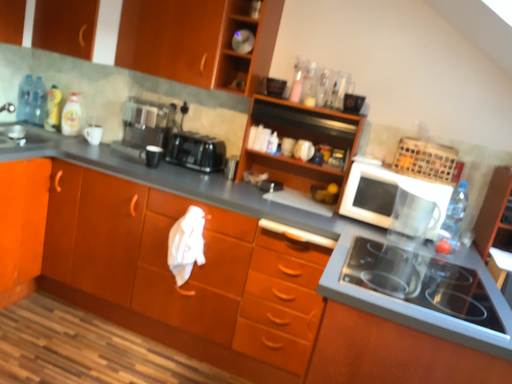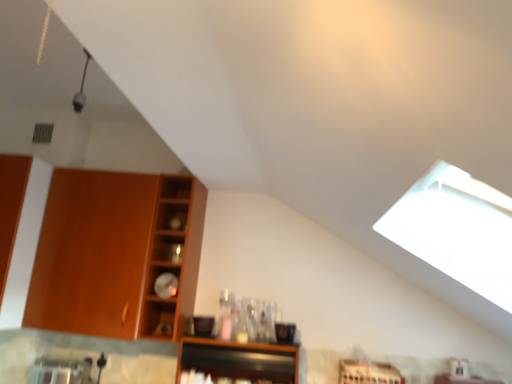
Question: Which way did the camera rotate in the video?

Choices:
 (A) rotated downward
 (B) rotated upward

Answer: (B)